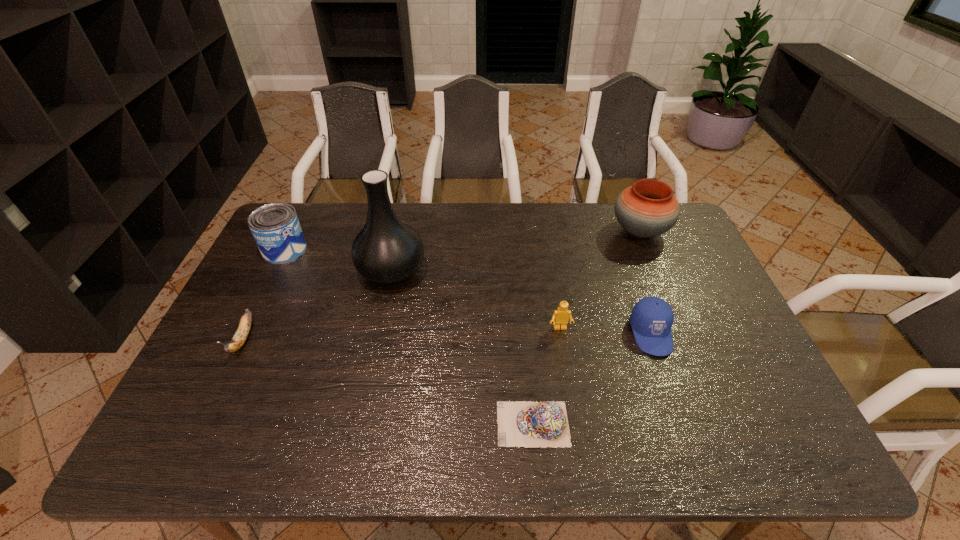
The width and height of the screenshot is (960, 540). I want to click on the tallest object, so click(x=387, y=250).

Where is `the fifth object from right to left`? Image resolution: width=960 pixels, height=540 pixels. the fifth object from right to left is located at coordinates (387, 250).

Find the location of a particular element. This screenshot has width=960, height=540. the sixth shortest object is located at coordinates (648, 208).

Image resolution: width=960 pixels, height=540 pixels. Identify the location of the third tallest object. (275, 227).

Find the location of `Lego`. Lego is located at coordinates (560, 318).

The height and width of the screenshot is (540, 960). I want to click on the taller cap, so click(x=651, y=319).

Identify the location of the right cap. (651, 319).

Find the location of a particular element. banana is located at coordinates (240, 336).

Image resolution: width=960 pixels, height=540 pixels. Identify the location of the shorter cap. (529, 424).

Locate an element on the screen. Image resolution: width=960 pixels, height=540 pixels. the nearest object is located at coordinates (529, 424).